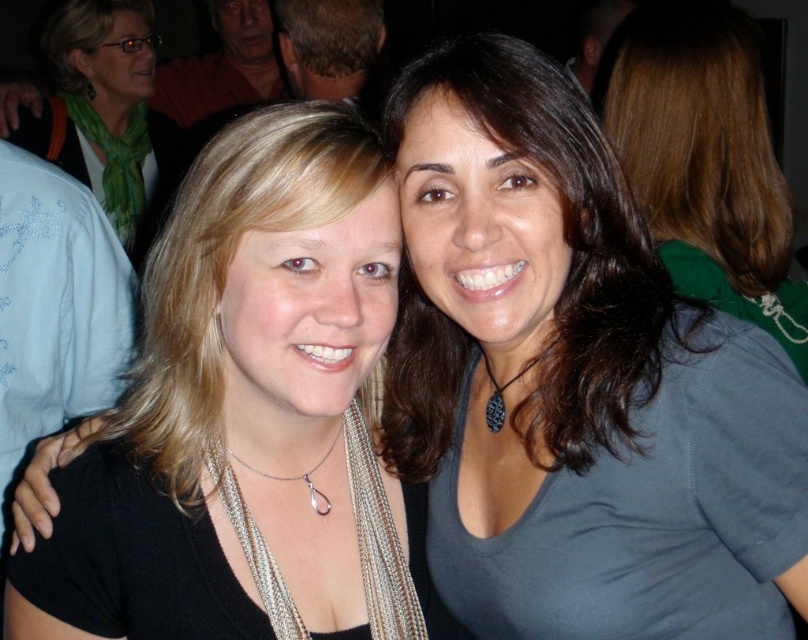
Looking at this image, is brown hair at upper center wider than green scarf at upper left?

No, brown hair at upper center is not wider than green scarf at upper left.

Is brown hair at upper center bigger than green scarf at upper left?

Incorrect, brown hair at upper center is not larger than green scarf at upper left.

This screenshot has width=808, height=640. In order to click on brown hair at upper center in this screenshot , I will do `click(705, 160)`.

Which of these two, black necklace at center or green scarf at upper left, stands shorter?

With less height is black necklace at center.

At what (x,y) coordinates should I click in order to perform the action: click on black necklace at center. Please return your answer as a coordinate pair (x, y). The image size is (808, 640). Looking at the image, I should click on (255, 364).

Locate an element on the screen. The image size is (808, 640). black necklace at center is located at coordinates (255, 364).

Is point (40, 128) behind point (330, 451)?

Yes, point (40, 128) is farther from viewer.

Is green scarf at upper left smaller than silver/pearl necklace at center?

Actually, green scarf at upper left might be larger than silver/pearl necklace at center.

Who is more forward, (121, 76) or (253, 470)?

Point (253, 470) is in front.

What are the coordinates of `green scarf at upper left` in the screenshot? It's located at (107, 113).